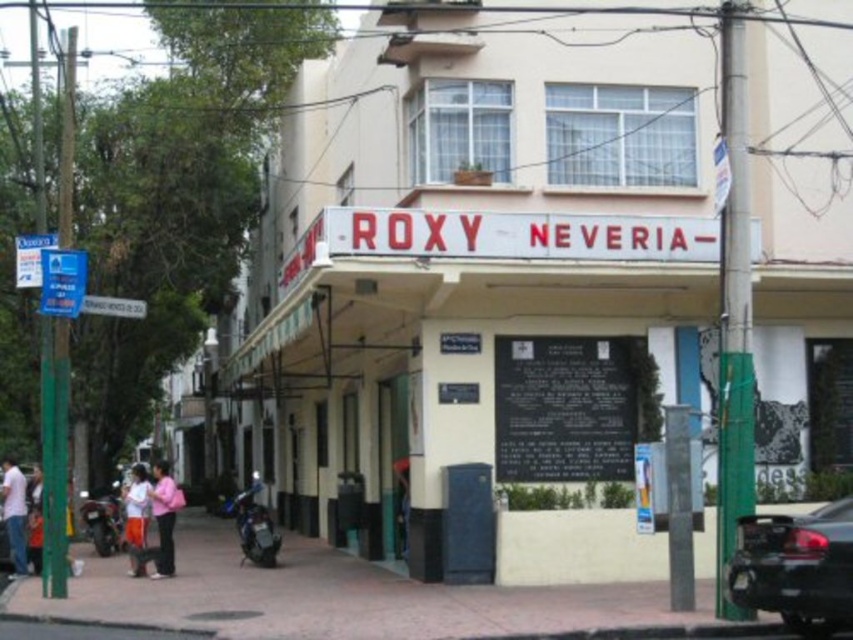
Question: Does pink fabric at lower left have a lesser width compared to shiny black motorcycle at lower left?

Choices:
 (A) yes
 (B) no

Answer: (B)

Question: Among these objects, which one is farthest from the camera?

Choices:
 (A) light blue jeans at lower left
 (B) orange cotton pants at lower left
 (C) shiny black car at lower right
 (D) pink fabric at lower left

Answer: (A)

Question: Which point is closer to the camera taking this photo?

Choices:
 (A) (814, 628)
 (B) (256, 484)
 (C) (97, 544)

Answer: (A)

Question: Can you confirm if shiny black car at lower right is positioned to the right of orange cotton pants at lower left?

Choices:
 (A) yes
 (B) no

Answer: (A)

Question: Which object appears closest to the camera in this image?

Choices:
 (A) orange cotton pants at lower left
 (B) shiny black motorcycle at lower left

Answer: (A)

Question: Where is blue plastic sign at left located in relation to pink fabric at lower left in the image?

Choices:
 (A) right
 (B) left

Answer: (A)